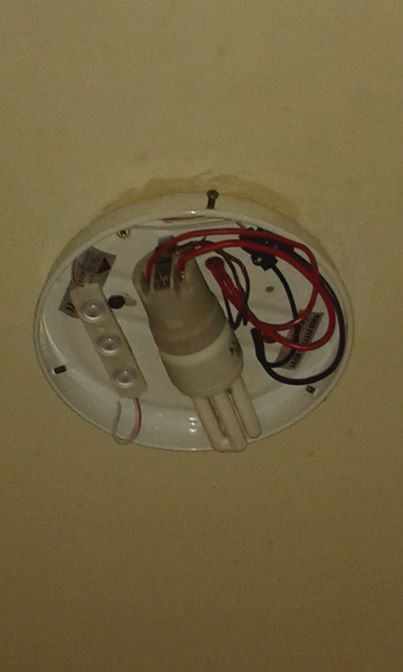
In order to click on light bulb recepticle in this screenshot , I will do 196,326.